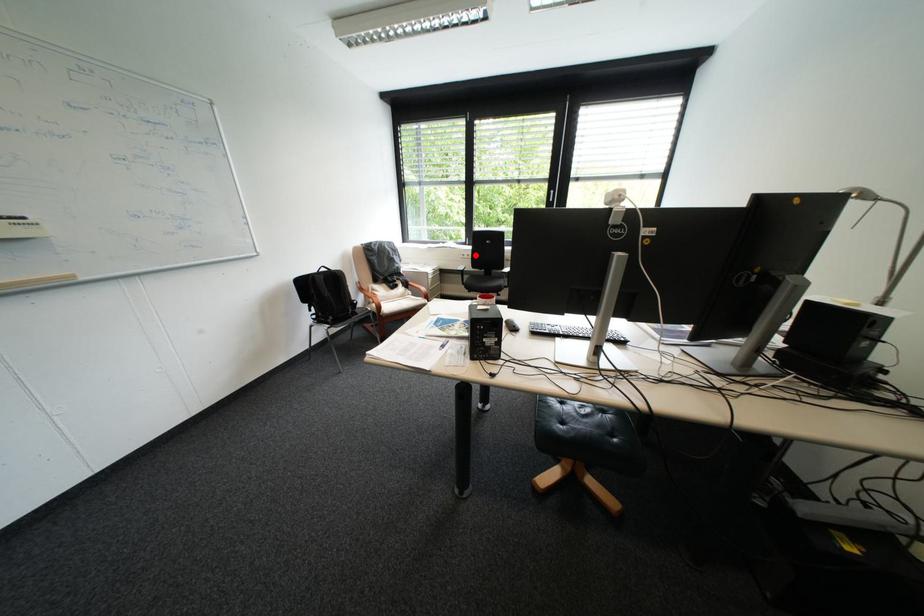
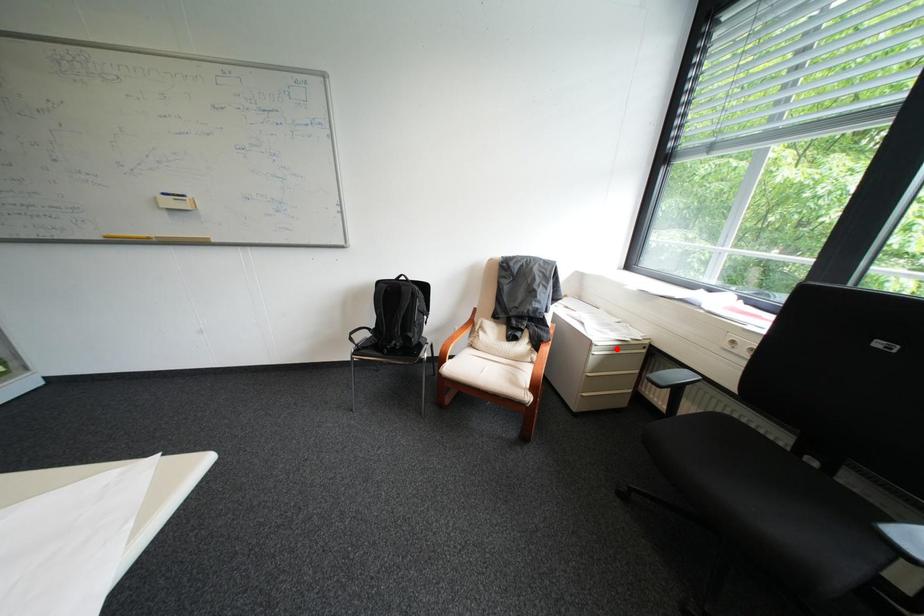
I am providing you with two images of the same scene from different viewpoints. A red point is marked on the first image and another point is marked on the second image. Are the points marked in image1 and image2 representing the same 3D position?

No